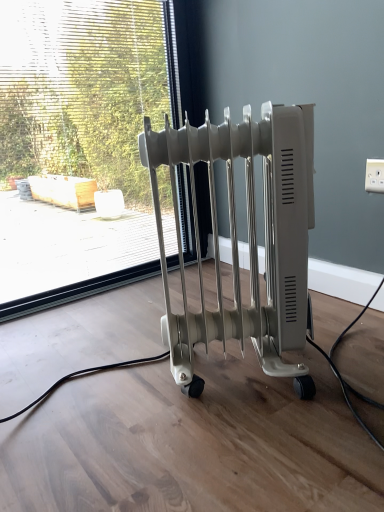
This screenshot has height=512, width=384. Find the location of `vacant area situated below white plastic radiator at center (from a real-world perspective)`. vacant area situated below white plastic radiator at center (from a real-world perspective) is located at coordinates (238, 383).